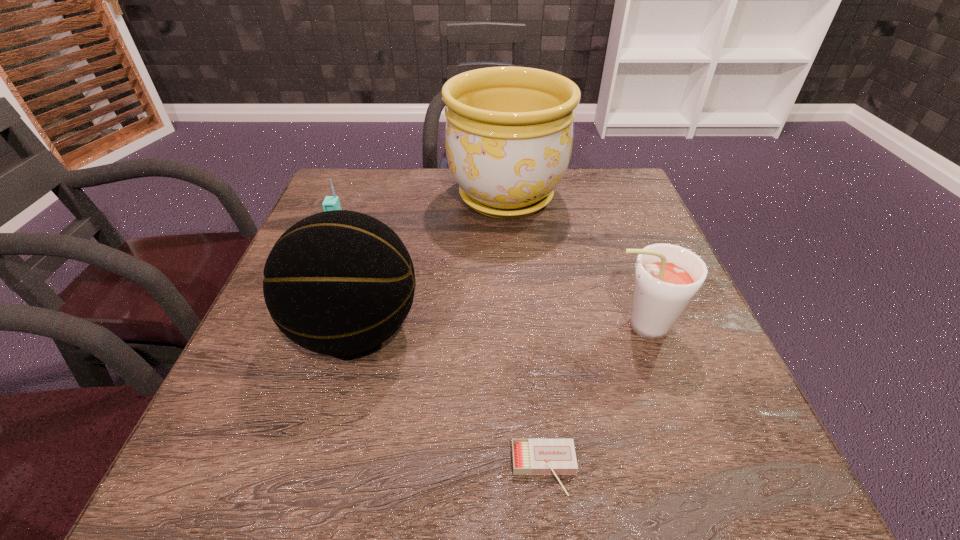
Identify the location of vacant space at the right edge of the desktop. (699, 375).

This screenshot has height=540, width=960. In order to click on free space at the near left corner in this screenshot , I will do `click(250, 451)`.

In the image, there is a desktop. What are the coordinates of `free space at the far right corner` in the screenshot? It's located at (614, 177).

Locate an element on the screen. free space between the second tallest object and the flowerpot is located at coordinates (431, 264).

Find the location of a particular element. The width and height of the screenshot is (960, 540). vacant point located between the matchbox and the flowerpot is located at coordinates click(525, 333).

Where is `free point between the fourth shortest object and the root beer`? The image size is (960, 540). free point between the fourth shortest object and the root beer is located at coordinates (497, 328).

Image resolution: width=960 pixels, height=540 pixels. I want to click on vacant area that lies between the basketball and the root beer, so click(497, 328).

Identify the location of free space between the nearest object and the root beer. (592, 398).

You are a GUI agent. You are given a task and a screenshot of the screen. Output one action in this format:
    pyautogui.click(x=<x>, y=<y>)
    Task: Click on the free area in between the fourth shortest object and the shortest object
    The image size is (960, 540).
    Given the screenshot: What is the action you would take?
    pyautogui.click(x=450, y=400)

Locate an element on the screen. The image size is (960, 540). vacant space that's between the nearest object and the cellular telephone is located at coordinates (442, 353).